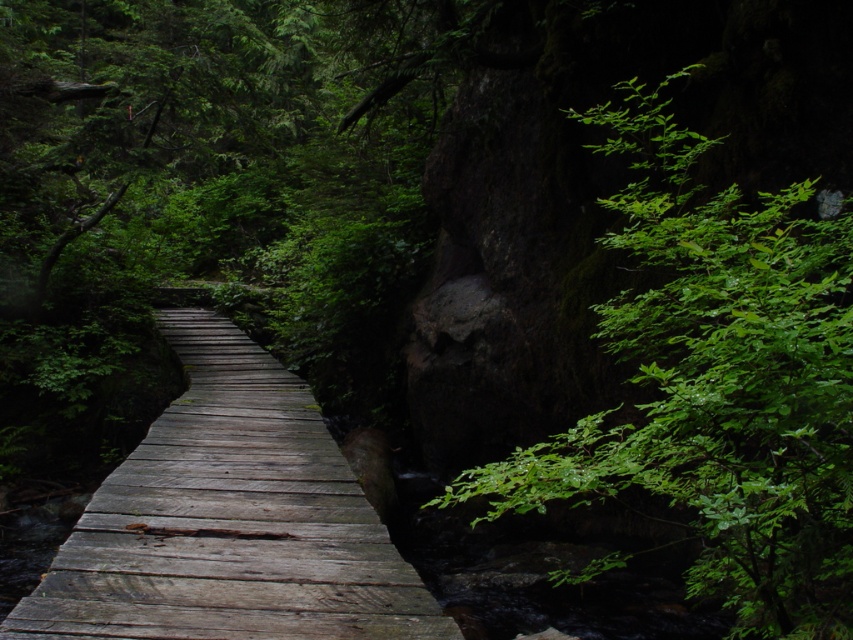
You are a hiker standing on the wooden bridge at center and looking towards the green leafy tree at right. Which object is closer to you?

The green leafy tree at right is closer to you because it is in front of the wooden bridge at center, meaning it is positioned nearer to your current location on the bridge.

You are a hiker with a 1.20 meter long backpack. You are standing on the wooden bridge and want to walk towards the green leafy tree at right. Can you safely walk towards it without the backpack hitting the tree?

The green leafy tree at right is 1.10 meters from viewer. Since the backpack is 1.20 meters long, it will extend beyond your body by 0.10 meters. However, the distance to the tree is only 1.10 meters, which is shorter than the backpack length. Therefore, the backpack will hit the tree if you proceed. To avoid damage, you should adjust your path or shorten the backpack.

You are standing at the center of the wooden bridge and want to reach the green leafy tree at right. Which direction should you walk to get there?

The green leafy tree at right is located at point (717,384), so you should walk towards the right side of the bridge to reach it.